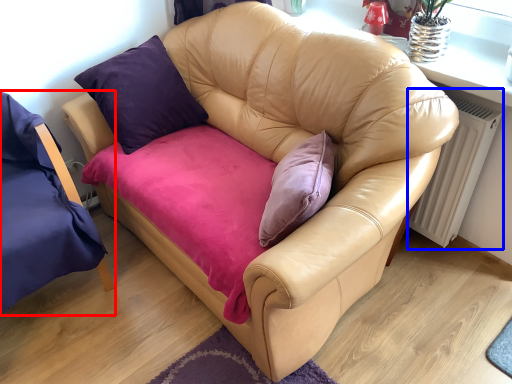
Question: Which object appears closest to the camera in this image, chair (highlighted by a red box) or radiator (highlighted by a blue box)?

Choices:
 (A) chair
 (B) radiator

Answer: (A)